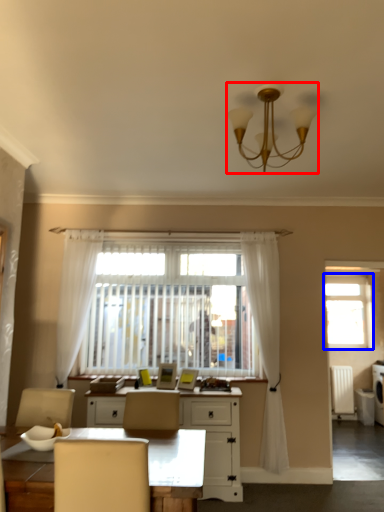
Question: Among these objects, which one is nearest to the camera, lamp (highlighted by a red box) or window (highlighted by a blue box)?

Choices:
 (A) lamp
 (B) window

Answer: (A)